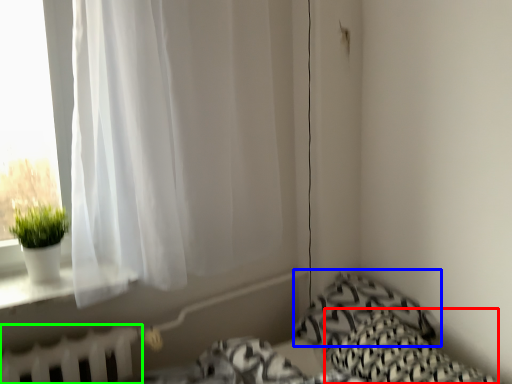
Question: Estimate the real-world distances between objects in this image. Which object is farther from pillow (highlighted by a red box), pillow (highlighted by a blue box) or radiator (highlighted by a green box)?

Choices:
 (A) pillow
 (B) radiator

Answer: (B)